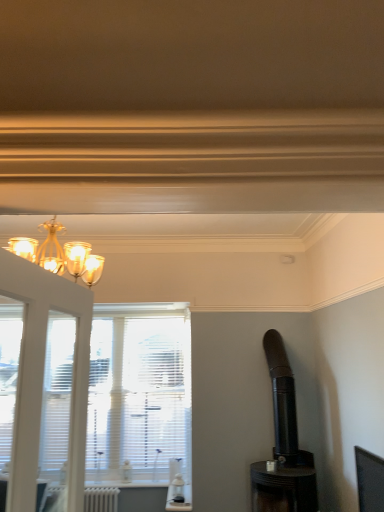
Question: From a real-world perspective, is white matte radiator at lower left positioned above or below black matte stove at right?

Choices:
 (A) below
 (B) above

Answer: (A)

Question: Considering the relative positions of white matte radiator at lower left and black matte stove at right in the image provided, is white matte radiator at lower left to the left or to the right of black matte stove at right?

Choices:
 (A) left
 (B) right

Answer: (A)

Question: Does point (99, 501) appear closer or farther from the camera than point (289, 458)?

Choices:
 (A) farther
 (B) closer

Answer: (A)

Question: Is black matte stove at right taller or shorter than white matte radiator at lower left?

Choices:
 (A) tall
 (B) short

Answer: (A)

Question: Is black matte stove at right in front of or behind white matte radiator at lower left in the image?

Choices:
 (A) behind
 (B) front

Answer: (B)

Question: Does point (281, 404) appear closer or farther from the camera than point (107, 490)?

Choices:
 (A) closer
 (B) farther

Answer: (A)

Question: From the image's perspective, is black matte stove at right located above or below white matte radiator at lower left?

Choices:
 (A) above
 (B) below

Answer: (A)